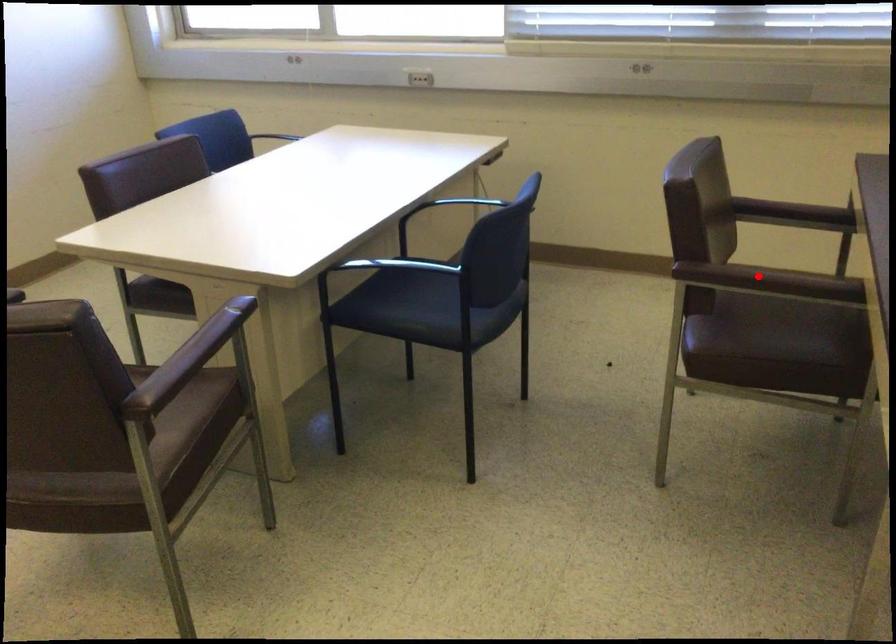
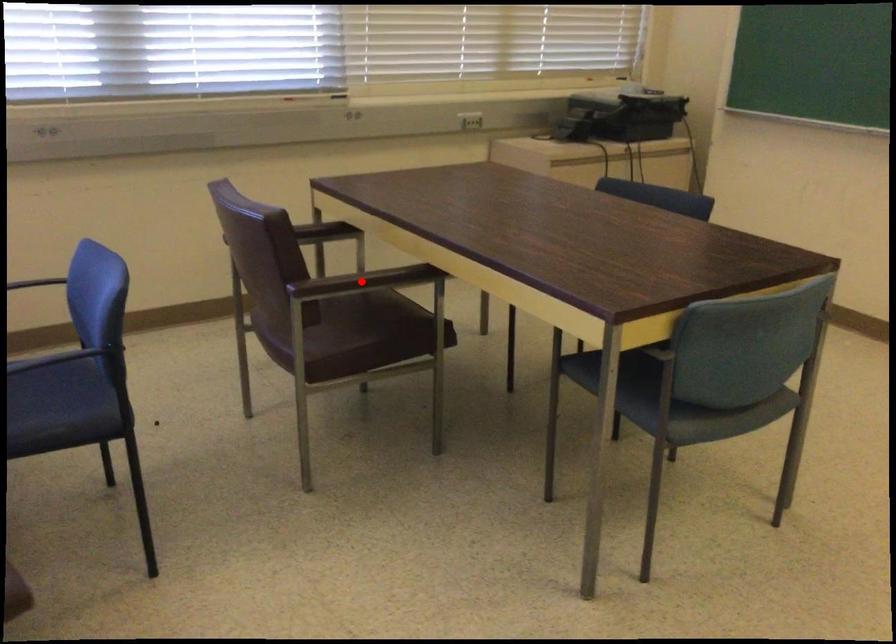
I am providing you with two images of the same scene from different viewpoints. A red point is marked on the first image and another point is marked on the second image. Do the highlighted points in image1 and image2 indicate the same real-world spot?

Yes